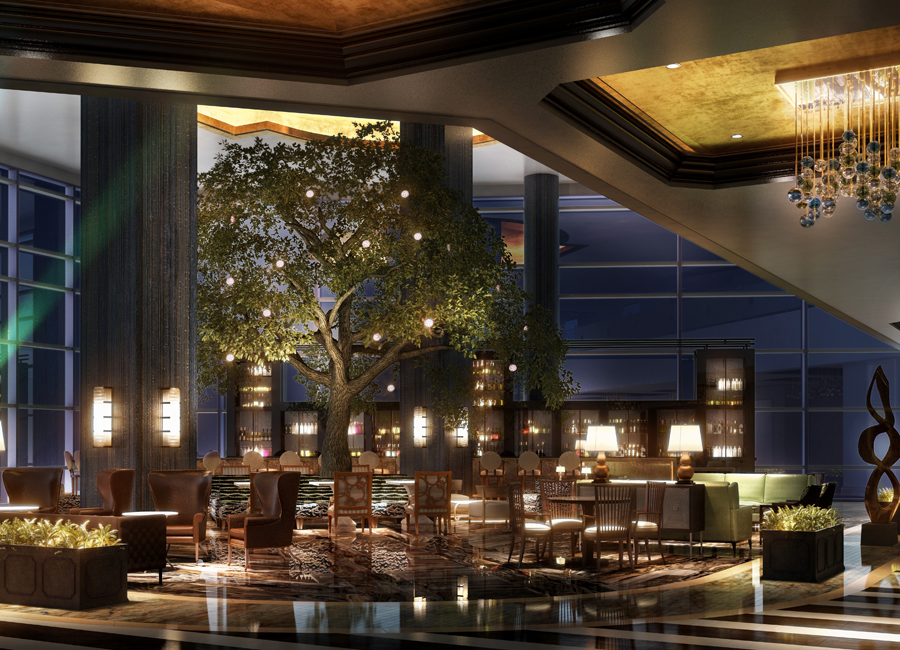
The height and width of the screenshot is (650, 900). In order to click on dining chairs in this screenshot , I will do `click(532, 532)`, `click(563, 517)`, `click(598, 525)`, `click(649, 525)`, `click(430, 506)`, `click(360, 511)`.